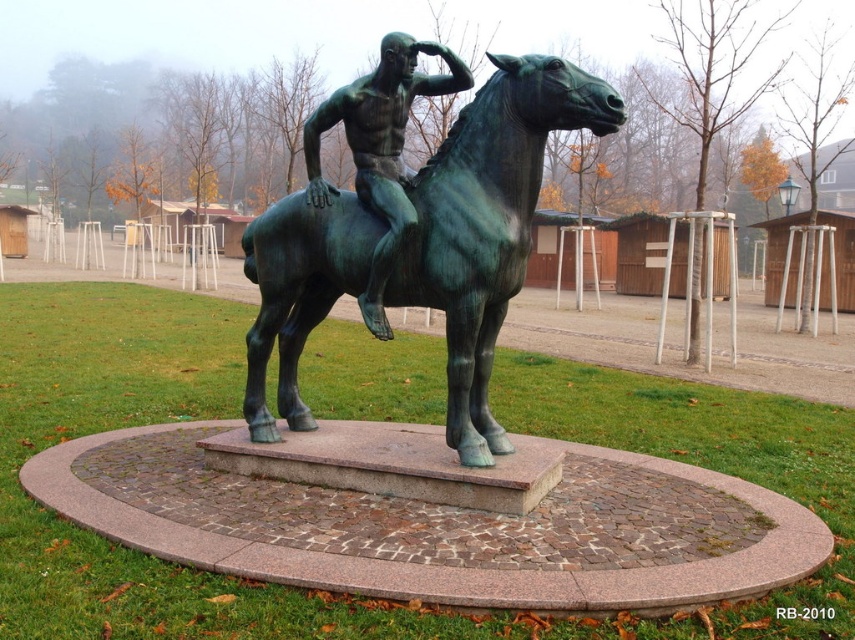
Question: Can you confirm if green patina horse at center is thinner than green patina statue at center?

Choices:
 (A) no
 (B) yes

Answer: (A)

Question: Observing the image, what is the correct spatial positioning of green patina horse at center in reference to green patina statue at center?

Choices:
 (A) below
 (B) above

Answer: (A)

Question: Is green patina horse at center positioned before green patina statue at center?

Choices:
 (A) no
 (B) yes

Answer: (B)

Question: Which point appears farthest from the camera in this image?

Choices:
 (A) (346, 88)
 (B) (437, 77)

Answer: (B)

Question: Which of the following is the farthest from the observer?

Choices:
 (A) (x=599, y=116)
 (B) (x=379, y=156)

Answer: (B)

Question: Which of the following is the closest to the observer?

Choices:
 (A) coord(405,84)
 (B) coord(475,248)

Answer: (B)